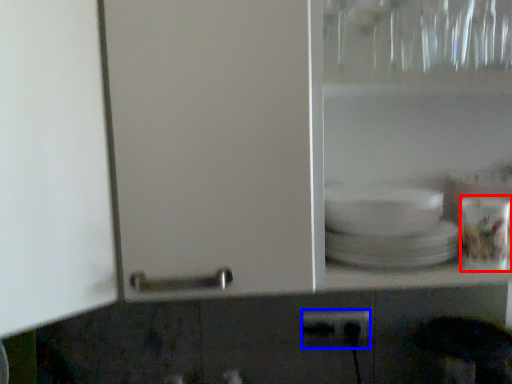
Question: Which point is further to the camera, tableware (highlighted by a red box) or power plugs and sockets (highlighted by a blue box)?

Choices:
 (A) tableware
 (B) power plugs and sockets

Answer: (B)